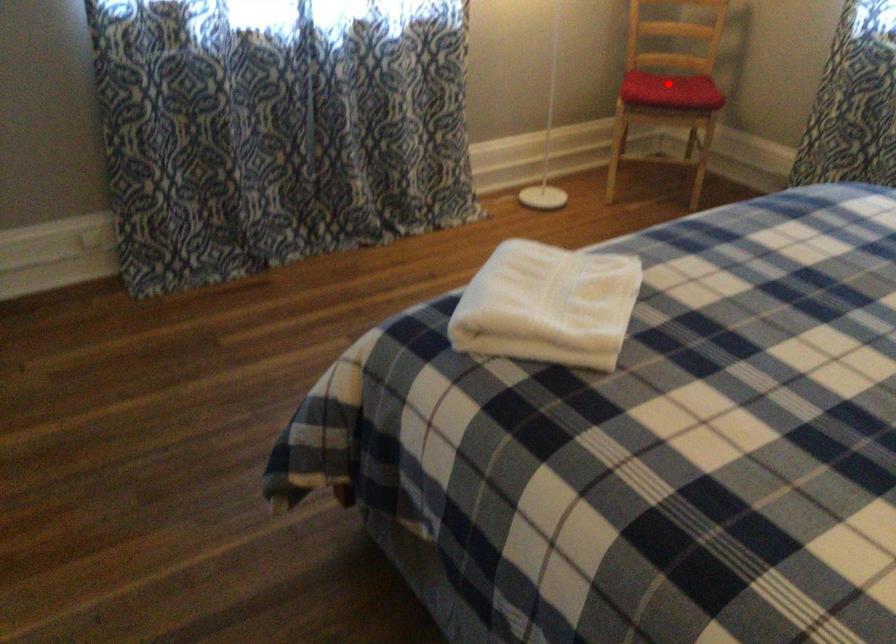
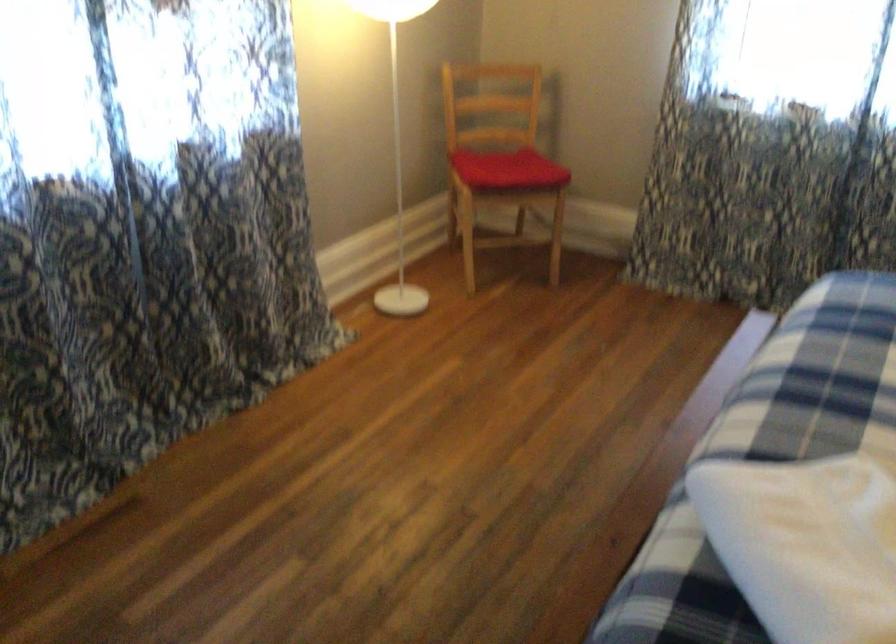
In the second image, find the point that corresponds to the highlighted location in the first image.

(507, 169)